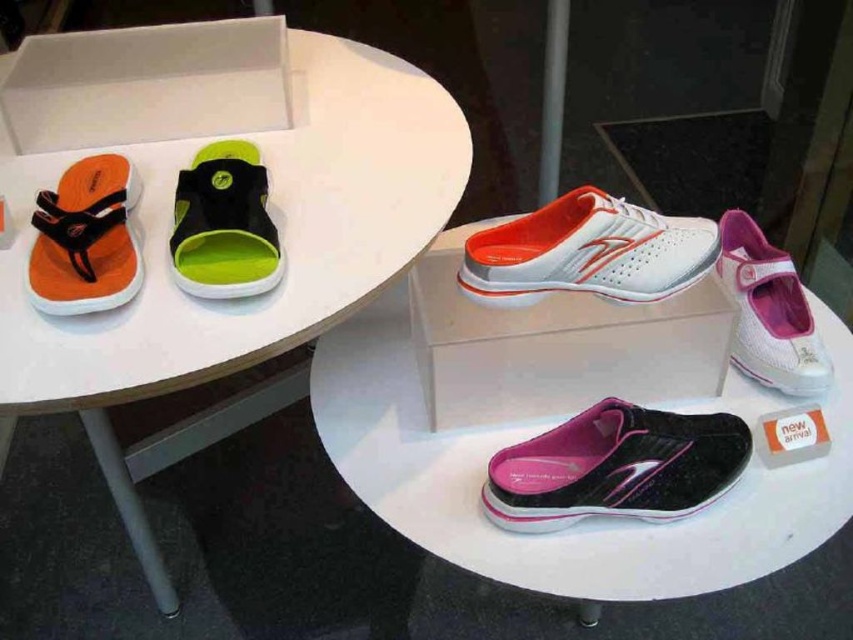
You are standing at the camera position looking at the display setup. There is a point marked at coordinates (555, 312) in the image. If you want to place a new item exactly 1 meter away from this point along the horizontal axis, where should you position it?

The point at (555, 312) is 93.00 centimeters from the camera. To place an item 1 meter away along the horizontal axis, you would move it 6.7 centimeters further away from the camera along the same horizontal line.

You are a customer looking at the white plastic table at upper left and the orange matte sandal at left. Which object is closer to you?

The white plastic table at upper left is closer to you because it is in front of the orange matte sandal at left.

Consider the image. You are a customer trying to choose between the white mesh shoe at upper center and the neon green rubber sandal at upper left. Based on their sizes, which one is wider?

The white mesh shoe at upper center is wider than the neon green rubber sandal at upper left according to their widths.